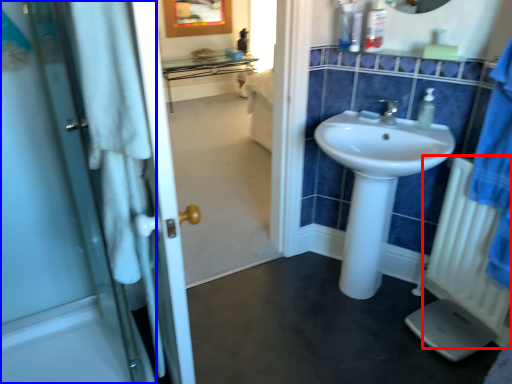
Question: Among these objects, which one is farthest to the camera, radiator (highlighted by a red box) or door (highlighted by a blue box)?

Choices:
 (A) radiator
 (B) door

Answer: (A)